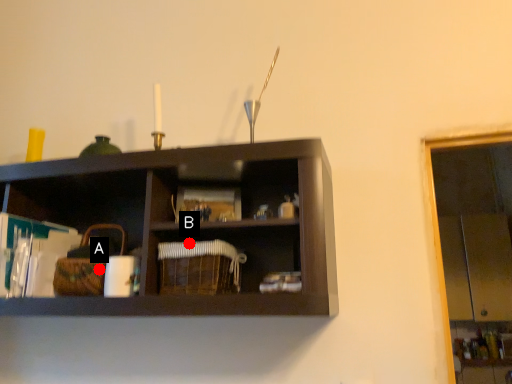
Question: Two points are circled on the image, labeled by A and B beside each circle. Which of the following is the closest to the observer?

Choices:
 (A) A is closer
 (B) B is closer

Answer: (B)